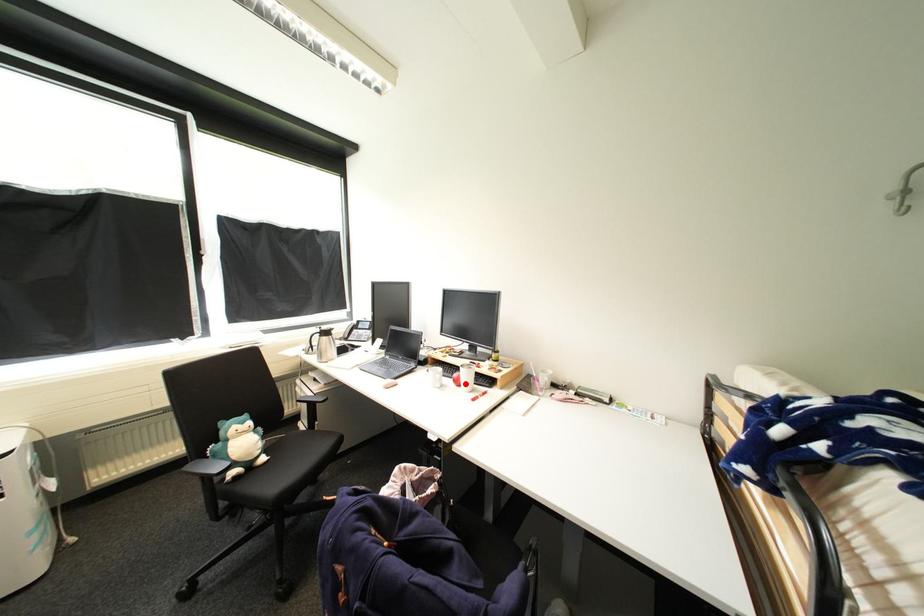
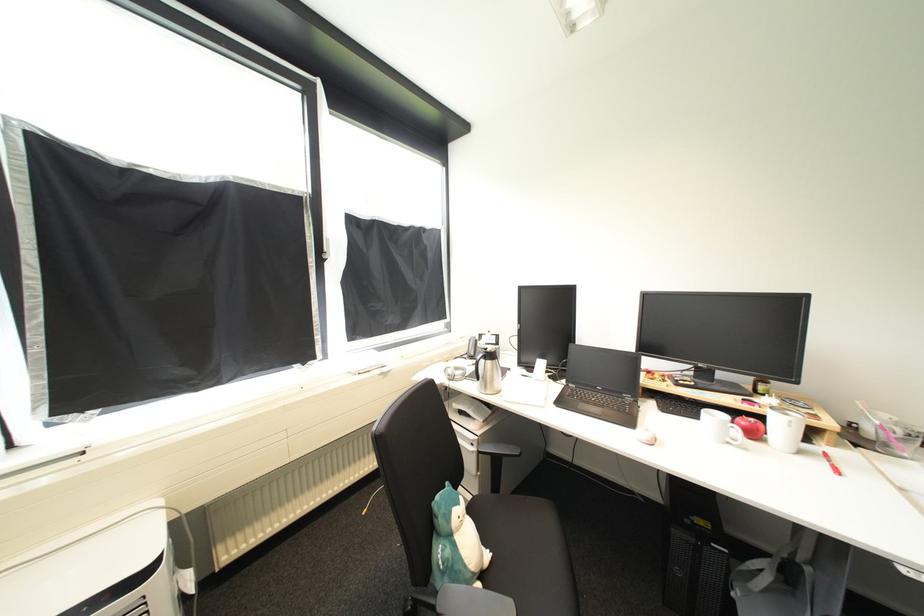
Where in the second image is the point corresponding to the highlighted location from the first image?

(761, 436)